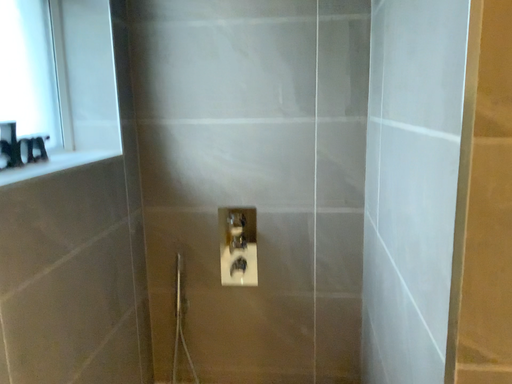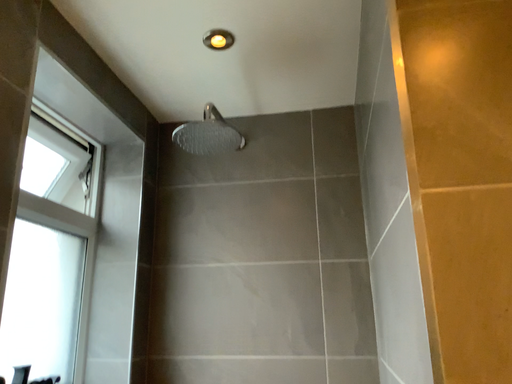
Question: How did the camera likely rotate when shooting the video?

Choices:
 (A) rotated upward
 (B) rotated downward

Answer: (A)